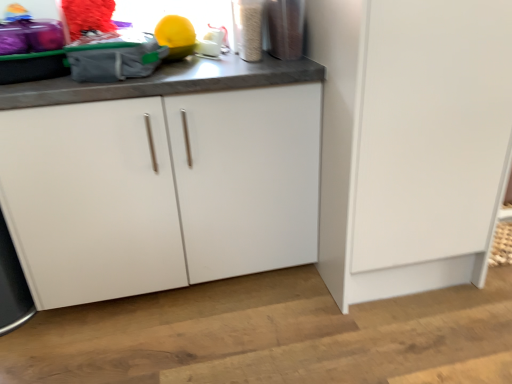
Question: From a real-world perspective, is metallic silver container at upper right, positioned as the second appliance in left-to-right order, on top of white matte cabinet at center?

Choices:
 (A) yes
 (B) no

Answer: (A)

Question: Considering the relative positions of metallic silver container at upper right, placed as the first appliance when sorted from right to left, and white matte cabinet at center in the image provided, is metallic silver container at upper right, placed as the first appliance when sorted from right to left, to the left of white matte cabinet at center from the viewer's perspective?

Choices:
 (A) yes
 (B) no

Answer: (B)

Question: Is metallic silver container at upper right, placed as the first appliance when sorted from right to left, bigger than white matte cabinet at center?

Choices:
 (A) yes
 (B) no

Answer: (B)

Question: Would you say metallic silver container at upper right, positioned as the second appliance in left-to-right order, is outside white matte cabinet at center?

Choices:
 (A) no
 (B) yes

Answer: (B)

Question: Is metallic silver container at upper right, placed as the first appliance when sorted from right to left, placed right next to white matte cabinet at center?

Choices:
 (A) yes
 (B) no

Answer: (B)

Question: Is white matte cabinet at center at the back of metallic silver container at upper right, placed as the first appliance when sorted from right to left?

Choices:
 (A) yes
 (B) no

Answer: (B)

Question: Considering the relative positions of metallic silver canister at upper right, the 1th appliance in the left-to-right sequence, and metallic silver container at upper right, positioned as the second appliance in left-to-right order, in the image provided, is metallic silver canister at upper right, the 1th appliance in the left-to-right sequence, to the left of metallic silver container at upper right, positioned as the second appliance in left-to-right order, from the viewer's perspective?

Choices:
 (A) yes
 (B) no

Answer: (A)

Question: Considering the relative sizes of metallic silver canister at upper right, the 1th appliance in the left-to-right sequence, and metallic silver container at upper right, placed as the first appliance when sorted from right to left, in the image provided, is metallic silver canister at upper right, the 1th appliance in the left-to-right sequence, thinner than metallic silver container at upper right, placed as the first appliance when sorted from right to left,?

Choices:
 (A) yes
 (B) no

Answer: (A)

Question: Is metallic silver canister at upper right, positioned as the second appliance in right-to-left order, aimed at metallic silver container at upper right, placed as the first appliance when sorted from right to left?

Choices:
 (A) yes
 (B) no

Answer: (B)

Question: Is the position of metallic silver canister at upper right, positioned as the second appliance in right-to-left order, more distant than that of metallic silver container at upper right, positioned as the second appliance in left-to-right order?

Choices:
 (A) no
 (B) yes

Answer: (A)

Question: Considering the relative sizes of metallic silver canister at upper right, positioned as the second appliance in right-to-left order, and metallic silver container at upper right, positioned as the second appliance in left-to-right order, in the image provided, is metallic silver canister at upper right, positioned as the second appliance in right-to-left order, wider than metallic silver container at upper right, positioned as the second appliance in left-to-right order,?

Choices:
 (A) yes
 (B) no

Answer: (B)

Question: Does metallic silver canister at upper right, positioned as the second appliance in right-to-left order, have a smaller size compared to metallic silver container at upper right, placed as the first appliance when sorted from right to left?

Choices:
 (A) no
 (B) yes

Answer: (B)

Question: Considering the relative sizes of white matte cabinet door at lower right and metallic silver container at upper right, positioned as the second appliance in left-to-right order, in the image provided, is white matte cabinet door at lower right taller than metallic silver container at upper right, positioned as the second appliance in left-to-right order,?

Choices:
 (A) yes
 (B) no

Answer: (A)